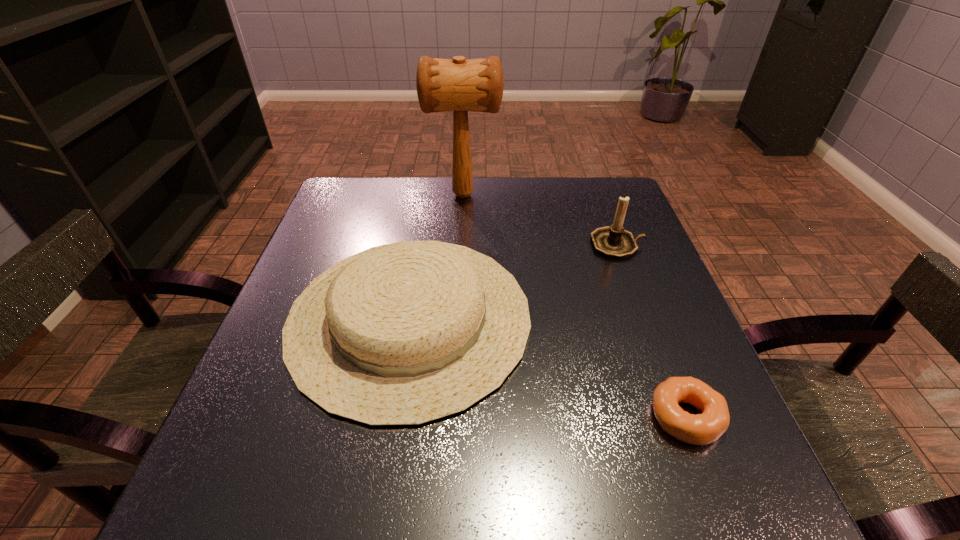
Find the location of a particular element. The image size is (960, 540). the farthest object is located at coordinates (458, 85).

This screenshot has height=540, width=960. I want to click on the tallest object, so click(458, 85).

Locate an element on the screen. This screenshot has height=540, width=960. candle holder is located at coordinates click(613, 241).

At what (x,y) coordinates should I click in order to perform the action: click on sunhat. Please return your answer as a coordinate pair (x, y). This screenshot has height=540, width=960. Looking at the image, I should click on (403, 334).

Identify the location of doughnut. (700, 429).

Locate an element on the screen. vacant space situated on the strike surface of the tallest object is located at coordinates (620, 195).

Locate an element on the screen. This screenshot has width=960, height=540. free spot located on the front of the candle holder is located at coordinates (633, 283).

Locate an element on the screen. Image resolution: width=960 pixels, height=540 pixels. free location located on the back of the third tallest object is located at coordinates (430, 189).

Identify the location of blank area located on the back of the shortest object. The height and width of the screenshot is (540, 960). pos(658,343).

At what (x,y) coordinates should I click in order to perform the action: click on object that is at the far edge. Please return your answer as a coordinate pair (x, y). This screenshot has width=960, height=540. Looking at the image, I should click on (458, 85).